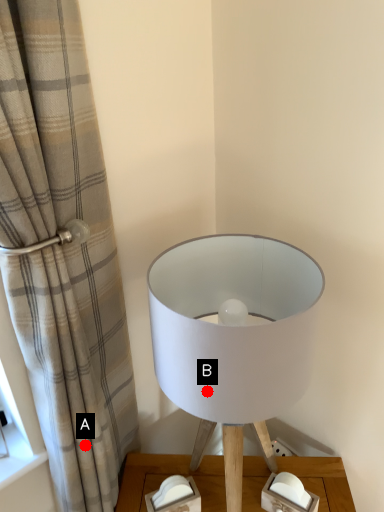
Question: Two points are circled on the image, labeled by A and B beside each circle. Which point appears farthest from the camera in this image?

Choices:
 (A) A is further
 (B) B is further

Answer: (A)